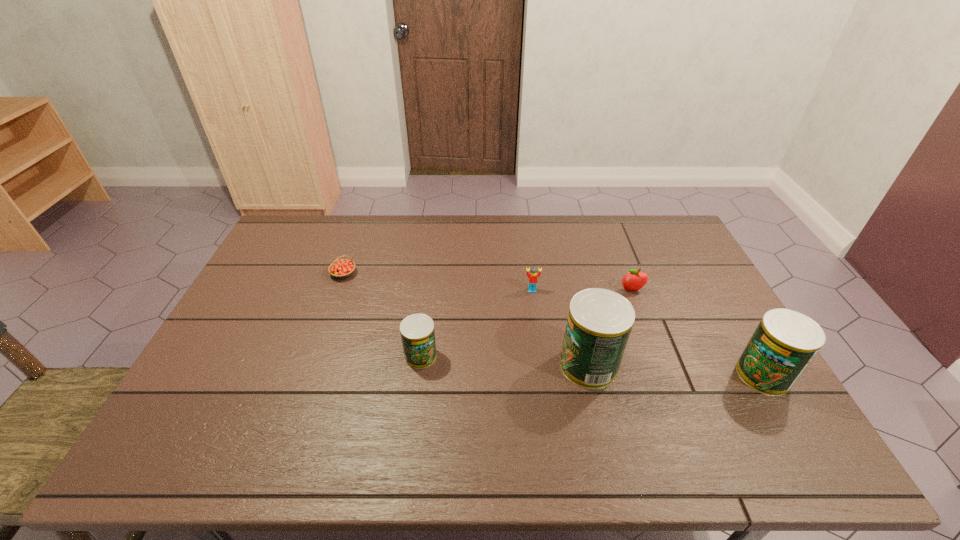
Image resolution: width=960 pixels, height=540 pixels. Find the location of `free spot between the rightmost object and the second can from left to right`. free spot between the rightmost object and the second can from left to right is located at coordinates (676, 370).

Identify the location of object that stands as the fifth closest to the leftmost can. (784, 343).

Find the location of `object that ranks as the closest to the second tallest object`. object that ranks as the closest to the second tallest object is located at coordinates (635, 280).

Image resolution: width=960 pixels, height=540 pixels. Find the location of `can that can be found as the closest to the Lego`. can that can be found as the closest to the Lego is located at coordinates (599, 323).

Identify which can is the second closest to the second can from right to left. Please provide its 2D coordinates. Your answer should be formatted as a tuple, i.e. [(x, y)], where the tuple contains the x and y coordinates of a point satisfying the conditions above.

[(417, 331)]

Identify the location of vacant region that satisfies the following two spatial constraints: 1. on the back side of the shortest can; 2. on the left side of the fifth object from left to right. (429, 291).

You are a GUI agent. You are given a task and a screenshot of the screen. Output one action in this format:
    pyautogui.click(x=<x>, y=<y>)
    Task: Click on the vacant space that satisfies the following two spatial constraints: 1. on the face of the second can from left to right; 2. on the right side of the fourth object from right to left
    The height and width of the screenshot is (540, 960).
    Given the screenshot: What is the action you would take?
    pyautogui.click(x=541, y=365)

This screenshot has width=960, height=540. I want to click on free location that satisfies the following two spatial constraints: 1. on the face of the second can from right to left; 2. on the right side of the Lego, so click(x=541, y=365).